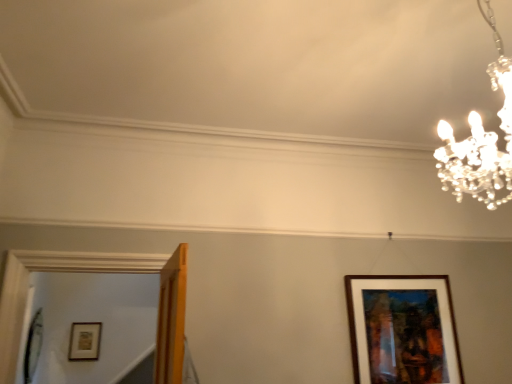
Question: Should I look upward or downward to see brown wooden picture frame at lower right, placed as the first picture frame when sorted from right to left?

Choices:
 (A) up
 (B) down

Answer: (B)

Question: Is clear crystal chandelier at upper right to the right of wooden picture frame at lower left, the 1th picture frame positioned from the left, from the viewer's perspective?

Choices:
 (A) no
 (B) yes

Answer: (B)

Question: Would you consider clear crystal chandelier at upper right to be distant from wooden picture frame at lower left, the second picture frame from the front?

Choices:
 (A) yes
 (B) no

Answer: (A)

Question: Is wooden picture frame at lower left, placed as the 2th picture frame when sorted from top to bottom, at the back of clear crystal chandelier at upper right?

Choices:
 (A) yes
 (B) no

Answer: (B)

Question: Can you confirm if clear crystal chandelier at upper right is taller than wooden picture frame at lower left, arranged as the 1th picture frame when viewed from the back?

Choices:
 (A) yes
 (B) no

Answer: (A)

Question: From a real-world perspective, is clear crystal chandelier at upper right below wooden picture frame at lower left, placed as the 2th picture frame when sorted from top to bottom?

Choices:
 (A) no
 (B) yes

Answer: (A)

Question: From the image's perspective, is clear crystal chandelier at upper right below wooden picture frame at lower left, arranged as the 1th picture frame when viewed from the back?

Choices:
 (A) yes
 (B) no

Answer: (B)

Question: Is the position of clear crystal chandelier at upper right more distant than that of brown wooden picture frame at lower right, acting as the first picture frame starting from the top?

Choices:
 (A) yes
 (B) no

Answer: (B)

Question: Is the position of clear crystal chandelier at upper right less distant than that of brown wooden picture frame at lower right, the 2th picture frame in the back-to-front sequence?

Choices:
 (A) yes
 (B) no

Answer: (A)

Question: Does clear crystal chandelier at upper right appear on the left side of brown wooden picture frame at lower right, the 2th picture frame in the back-to-front sequence?

Choices:
 (A) no
 (B) yes

Answer: (B)

Question: Does clear crystal chandelier at upper right have a greater width compared to brown wooden picture frame at lower right, positioned as the 2th picture frame in left-to-right order?

Choices:
 (A) yes
 (B) no

Answer: (A)

Question: From the image's perspective, is clear crystal chandelier at upper right below brown wooden picture frame at lower right, which ranks as the second picture frame in bottom-to-top order?

Choices:
 (A) no
 (B) yes

Answer: (A)

Question: Can you confirm if clear crystal chandelier at upper right is bigger than brown wooden picture frame at lower right, acting as the first picture frame starting from the top?

Choices:
 (A) yes
 (B) no

Answer: (A)

Question: From a real-world perspective, is brown wooden picture frame at lower right, the 2th picture frame in the back-to-front sequence, located higher than wooden picture frame at lower left, arranged as the 1th picture frame when viewed from the back?

Choices:
 (A) yes
 (B) no

Answer: (A)